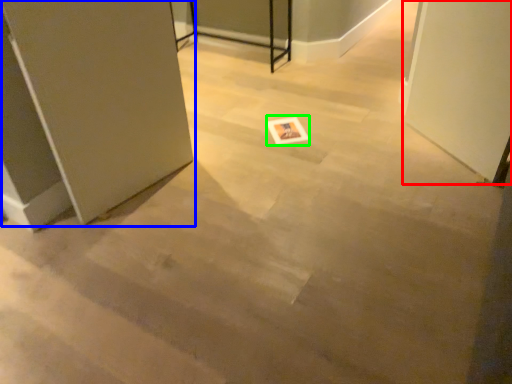
Question: Which is nearer to the screen door (highlighted by a red box)? door (highlighted by a blue box) or postcard (highlighted by a green box).

Choices:
 (A) door
 (B) postcard

Answer: (B)